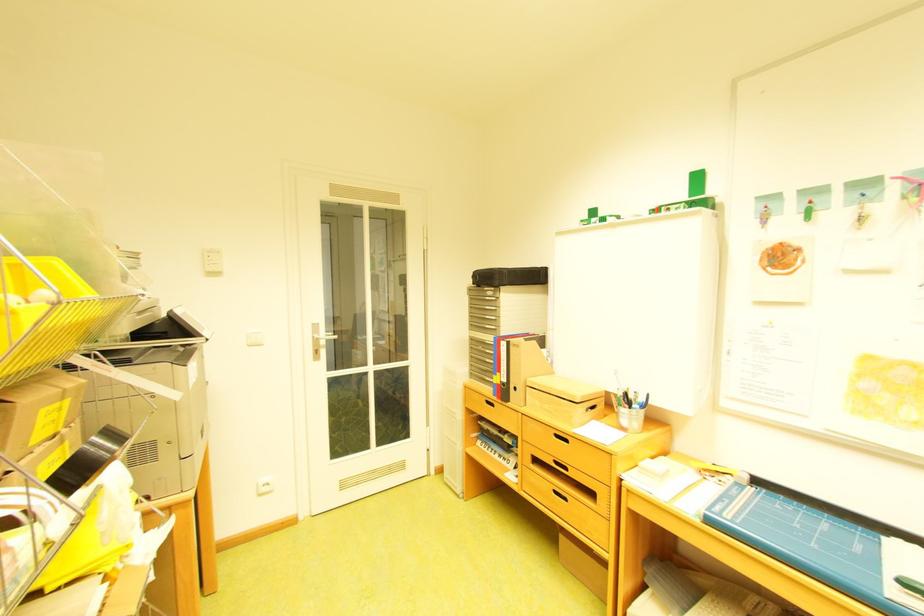
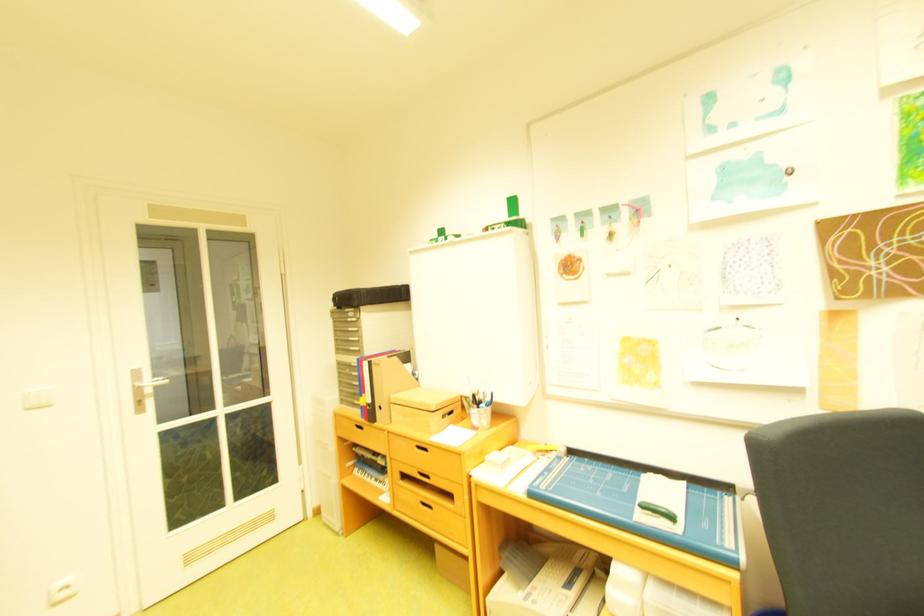
In a continuous first-person perspective shot, in which direction is the camera moving?

The cameraman moved toward right, backward.